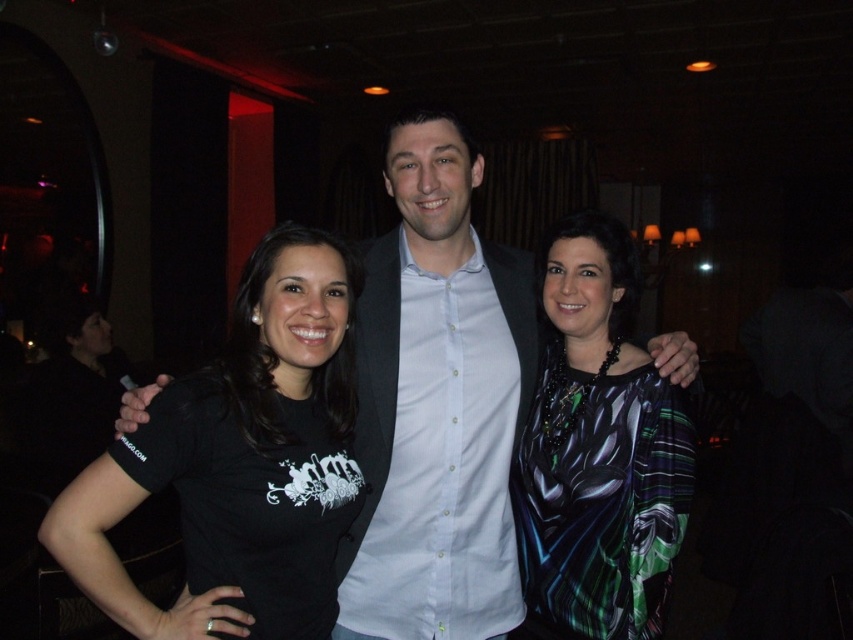
You are at a social event and want to introduce yourself to the person wearing the shiny silk blouse at center. Which direction should you move relative to the white shirt at center?

The white shirt at center is to the left of the shiny silk blouse at center, so you should move to the right relative to the white shirt at center to reach the shiny silk blouse at center.

You are standing in the room and want to move from the point at coordinates point (386,618) to point (292,579). Is the path between them clear?

The point at coordinates point (386,618) is behind point (292,579), so the path between them is blocked by the central figure.